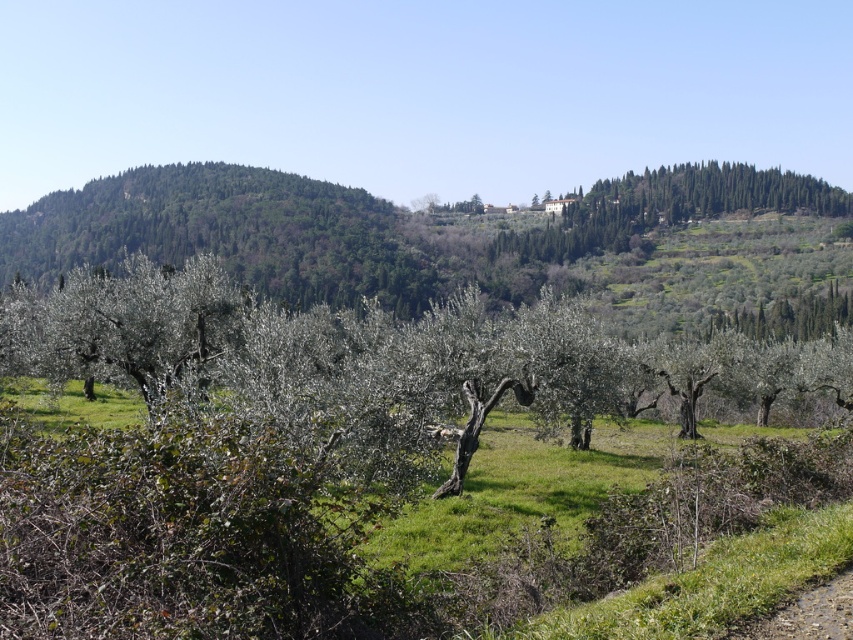
You are standing in the rural landscape and want to walk from the point closer to you to the point further away. Which path would you take between the two points, point (90,275) and point (753,173)?

You should walk towards point (753,173) since it is further away from you compared to point (90,275) which is closer.

You are standing at the origin point in the image, which is the bottom left corner. You want to walk towards the green leafy tree at center. In which direction should you head relative to your current position?

Since the green leafy tree at center is located at coordinates approximately 0.570 on the x axis and 0.449 on the y axis, you should head northeast from your current position at the origin point.

You are a farmer checking the growth of your olive trees. You notice the green leafy tree at center and the green leafy trees at upper right. Which group has taller trees?

The green leafy trees at upper right are taller than the green leafy tree at center.